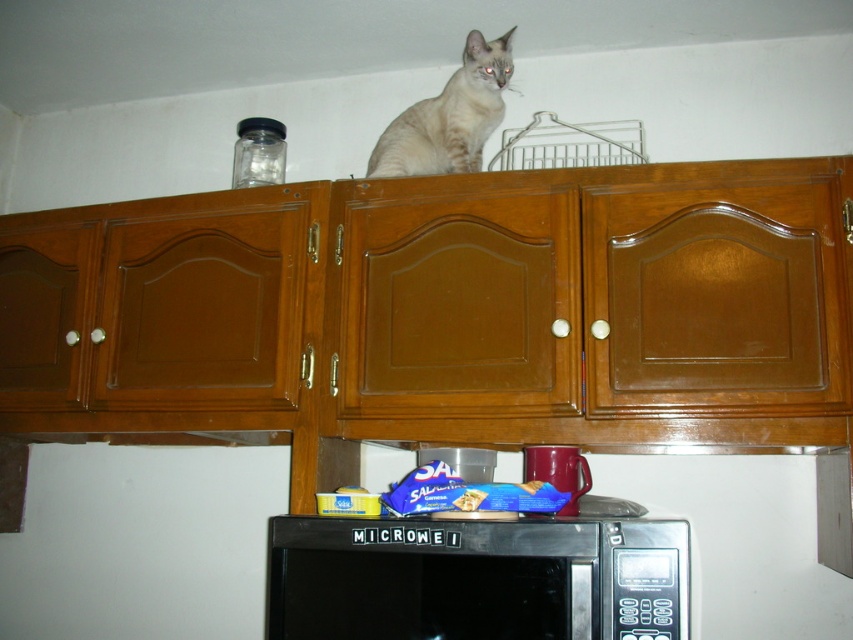
Between wooden at upper center and glossy ceramic mug at upper center, which one is positioned lower?

Positioned lower is glossy ceramic mug at upper center.

Looking at this image, which is above, wooden at upper center or glossy ceramic mug at upper center?

wooden at upper center is higher up.

Where is `wooden at upper center`? The image size is (853, 640). wooden at upper center is located at coordinates (457, 301).

Where is `wooden at upper center`? wooden at upper center is located at coordinates (457, 301).

Is point (364, 406) closer to viewer compared to point (445, 138)?

That is True.

Is wooden at upper center further to camera compared to light brown fur cat at upper center?

No.

Is point (482, 202) positioned behind point (422, 145)?

No, it is in front of (422, 145).

You are a GUI agent. You are given a task and a screenshot of the screen. Output one action in this format:
    pyautogui.click(x=<x>, y=<y>)
    Task: Click on the wooden at upper center
    
    Given the screenshot: What is the action you would take?
    pyautogui.click(x=457, y=301)

Can you confirm if light brown fur cat at upper center is shorter than glossy ceramic mug at upper center?

In fact, light brown fur cat at upper center may be taller than glossy ceramic mug at upper center.

Is light brown fur cat at upper center positioned before glossy ceramic mug at upper center?

No, it is behind glossy ceramic mug at upper center.

Which is behind, point (372, 168) or point (549, 476)?

The point (372, 168) is behind.

Identify the location of light brown fur cat at upper center. (450, 116).